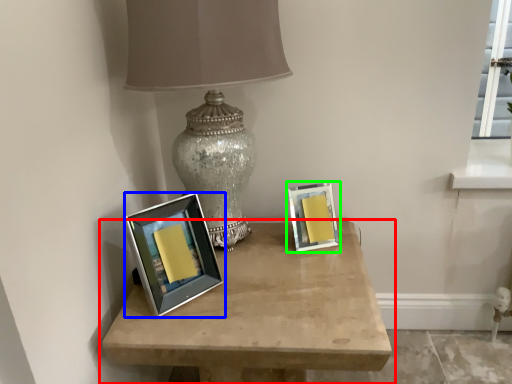
Question: Which object is positioned closest to table (highlighted by a red box)? Select from picture frame (highlighted by a blue box) and picture frame (highlighted by a green box).

Choices:
 (A) picture frame
 (B) picture frame

Answer: (A)